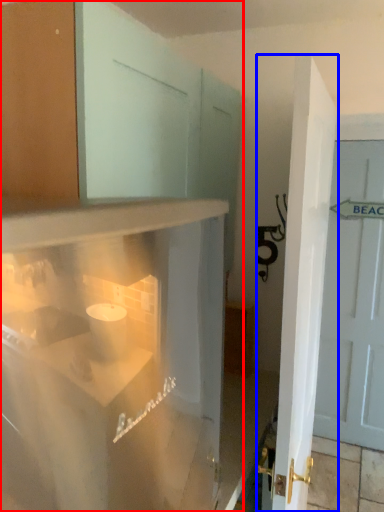
Question: Among these objects, which one is nearest to the camera, cabinetry (highlighted by a red box) or door (highlighted by a blue box)?

Choices:
 (A) cabinetry
 (B) door

Answer: (A)